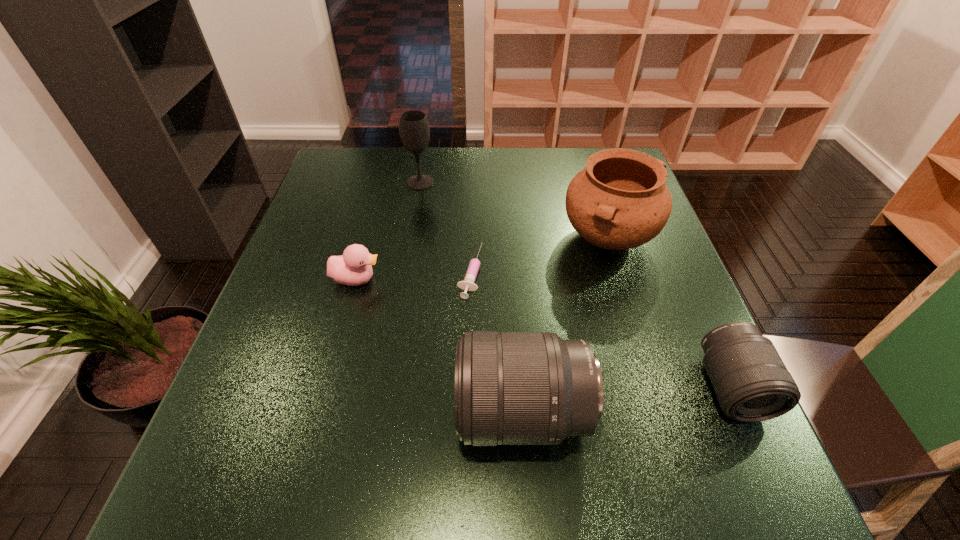
Find the location of a particular element. Image resolution: width=960 pixels, height=540 pixels. free region located on the surface of the taller telephoto lens is located at coordinates (301, 413).

Identify the location of vacant space situated 0.270m on the front of the farthest object. (408, 256).

Identify the location of vacant space located 0.360m on the back of the shortest object. (472, 167).

Locate an element on the screen. vacant space located on the front of the pottery is located at coordinates (646, 363).

Where is `vacant area located 0.120m on the front-facing side of the leftmost object`? Image resolution: width=960 pixels, height=540 pixels. vacant area located 0.120m on the front-facing side of the leftmost object is located at coordinates (435, 279).

At what (x,y) coordinates should I click in order to perform the action: click on object that is at the far edge. Please return your answer as a coordinate pair (x, y). Looking at the image, I should click on (414, 129).

Where is `object situated at the left edge`? object situated at the left edge is located at coordinates (353, 268).

Image resolution: width=960 pixels, height=540 pixels. Find the location of `telephoto lens that is at the right edge`. telephoto lens that is at the right edge is located at coordinates (751, 382).

At what (x,y) coordinates should I click in order to perform the action: click on pottery that is at the right edge. Please return your answer as a coordinate pair (x, y). Looking at the image, I should click on (620, 201).

Locate an element on the screen. The height and width of the screenshot is (540, 960). object that is at the near right corner is located at coordinates (751, 382).